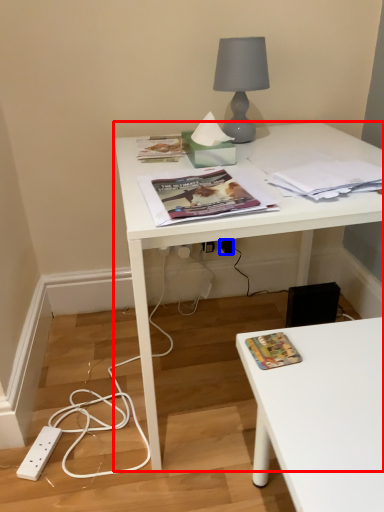
Question: Which point is further to the camera, desk (highlighted by a red box) or electric outlet (highlighted by a blue box)?

Choices:
 (A) desk
 (B) electric outlet

Answer: (B)